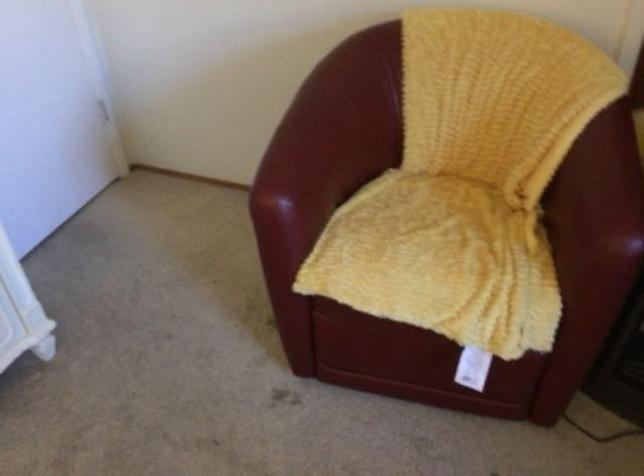
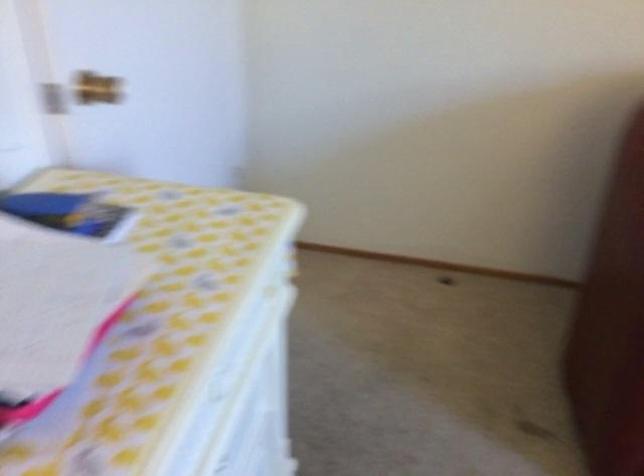
What movement of the cameraman would produce the second image?

The movement direction of the cameraman is left, forward.